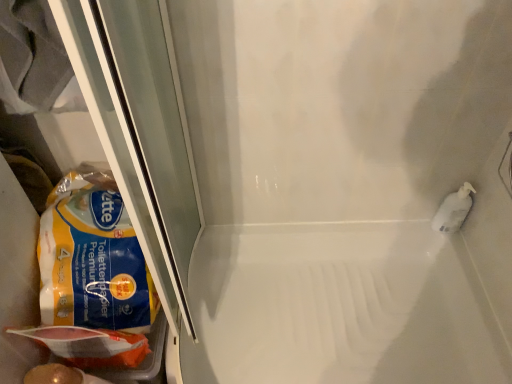
This screenshot has height=384, width=512. In order to click on yellow matte paper towel at left in this screenshot , I will do [92, 257].

Who is smaller, yellow matte paper towel at left or white glossy bath at center?

Smaller between the two is yellow matte paper towel at left.

At what (x,y) coordinates should I click in order to perform the action: click on cereal above the white glossy bath at center (from a real-world perspective). Please return your answer as a coordinate pair (x, y). Looking at the image, I should click on (92, 257).

From a real-world perspective, is yellow matte paper towel at left on top of white glossy bath at center?

Yes, from a real-world perspective, yellow matte paper towel at left is over white glossy bath at center

Is yellow matte paper towel at left far from white glossy bath at center?

yellow matte paper towel at left is near white glossy bath at center, not far away.

In terms of height, does matte plastic bag at lower left look taller or shorter compared to white glossy bath at center?

Clearly, matte plastic bag at lower left is taller compared to white glossy bath at center.

Considering the positions of objects matte plastic bag at lower left and white glossy bath at center in the image provided, who is more to the left, matte plastic bag at lower left or white glossy bath at center?

From the viewer's perspective, matte plastic bag at lower left appears more on the left side.

From the image's perspective, between matte plastic bag at lower left and white glossy bath at center, which one is located above?

matte plastic bag at lower left.

Measure the distance from matte plastic bag at lower left to white glossy bath at center.

They are 19.86 inches apart.

Where is `food located above the white glossy bath at center (from a real-world perspective)`? The height and width of the screenshot is (384, 512). food located above the white glossy bath at center (from a real-world perspective) is located at coordinates (90, 345).

Based on the photo, looking at the image, does white glossy bath at center seem bigger or smaller compared to matte plastic bag at lower left?

In the image, white glossy bath at center appears to be larger than matte plastic bag at lower left.

In the scene shown: Considering the sizes of white glossy bath at center and matte plastic bag at lower left in the image, is white glossy bath at center taller or shorter than matte plastic bag at lower left?

Clearly, white glossy bath at center is shorter compared to matte plastic bag at lower left.

Measure the distance between matte plastic bag at lower left and yellow matte paper towel at left.

5.68 inches.

In the scene shown: Does matte plastic bag at lower left lie behind yellow matte paper towel at left?

No, the depth of matte plastic bag at lower left is less than that of yellow matte paper towel at left.

From their relative heights in the image, would you say matte plastic bag at lower left is taller or shorter than yellow matte paper towel at left?

In the image, matte plastic bag at lower left appears to be shorter than yellow matte paper towel at left.

The image size is (512, 384). What are the coordinates of `food below the yellow matte paper towel at left (from the image's perspective)` in the screenshot? It's located at (90, 345).

Between point (142, 259) and point (118, 354), which one is positioned in front?

Point (118, 354)

Image resolution: width=512 pixels, height=384 pixels. Find the location of `food in front of the yellow matte paper towel at left`. food in front of the yellow matte paper towel at left is located at coordinates (90, 345).

Is the surface of white glossy bath at center in direct contact with yellow matte paper towel at left?

No, white glossy bath at center is not in contact with yellow matte paper towel at left.

Is white glossy bath at center located outside yellow matte paper towel at left?

Yes, white glossy bath at center is located beyond the bounds of yellow matte paper towel at left.

Image resolution: width=512 pixels, height=384 pixels. What are the coordinates of `bath behind the yellow matte paper towel at left` in the screenshot? It's located at (x=339, y=307).

Where is `food on the left of white glossy bath at center`? The width and height of the screenshot is (512, 384). food on the left of white glossy bath at center is located at coordinates (90, 345).

Considering their positions, is yellow matte paper towel at left positioned further to matte plastic bag at lower left than white glossy bath at center?

white glossy bath at center lies further to matte plastic bag at lower left than the other object.

When comparing their distances from white glossy bath at center, does yellow matte paper towel at left or matte plastic bag at lower left seem further?

matte plastic bag at lower left is further to white glossy bath at center.

Based on their spatial positions, is matte plastic bag at lower left or yellow matte paper towel at left further from white glossy bath at center?

matte plastic bag at lower left is positioned further to the anchor white glossy bath at center.

Looking at the image, which one is located closer to yellow matte paper towel at left, white glossy bath at center or matte plastic bag at lower left?

matte plastic bag at lower left.

Which object lies further to the anchor point yellow matte paper towel at left, matte plastic bag at lower left or white glossy bath at center?

white glossy bath at center is positioned further to the anchor yellow matte paper towel at left.

From the image, which object appears to be farther from matte plastic bag at lower left, white glossy bath at center or yellow matte paper towel at left?

Based on the image, white glossy bath at center appears to be further to matte plastic bag at lower left.

In order to click on cereal between matte plastic bag at lower left and white glossy bath at center from left to right in this screenshot , I will do `click(92, 257)`.